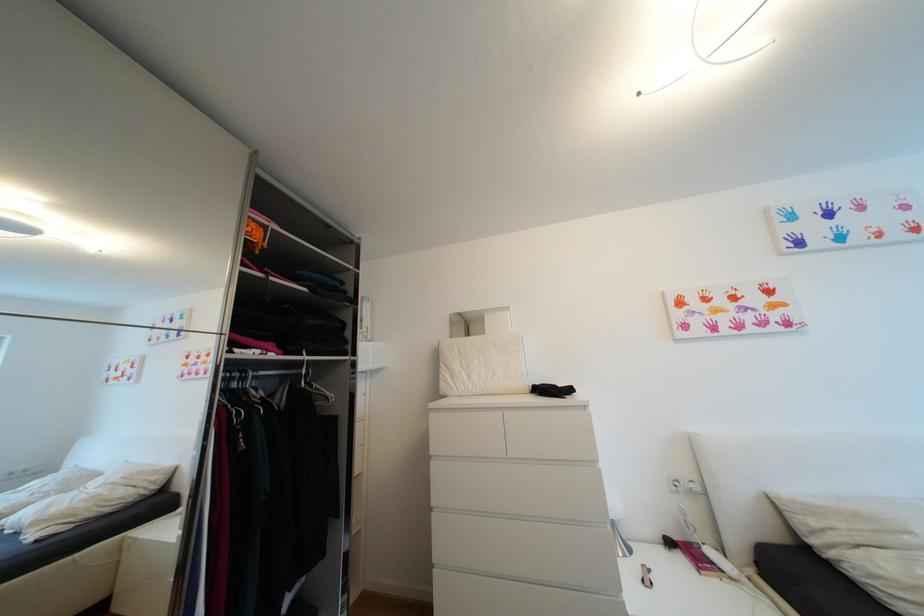
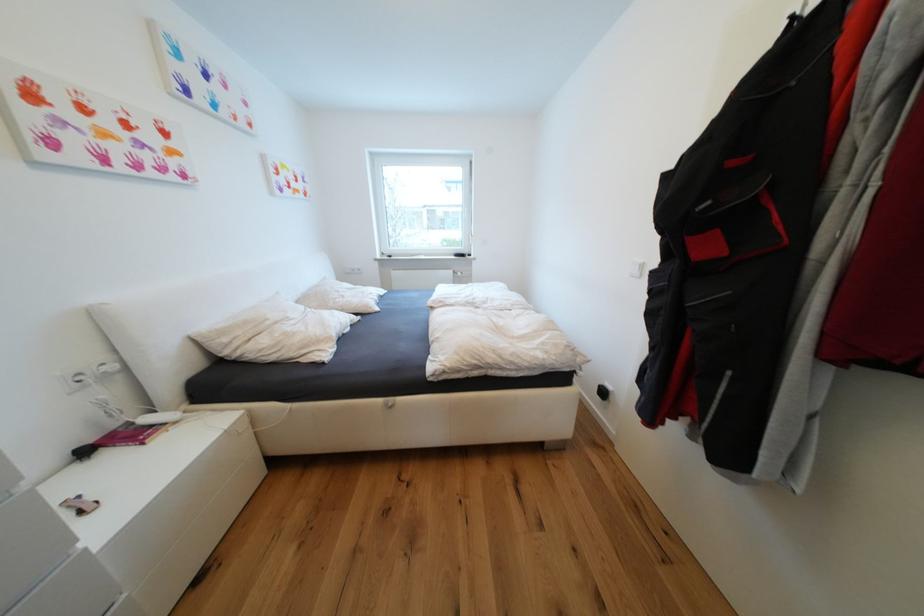
Find the pixel in the second image that matches (x=702, y=488) in the first image.

(119, 369)